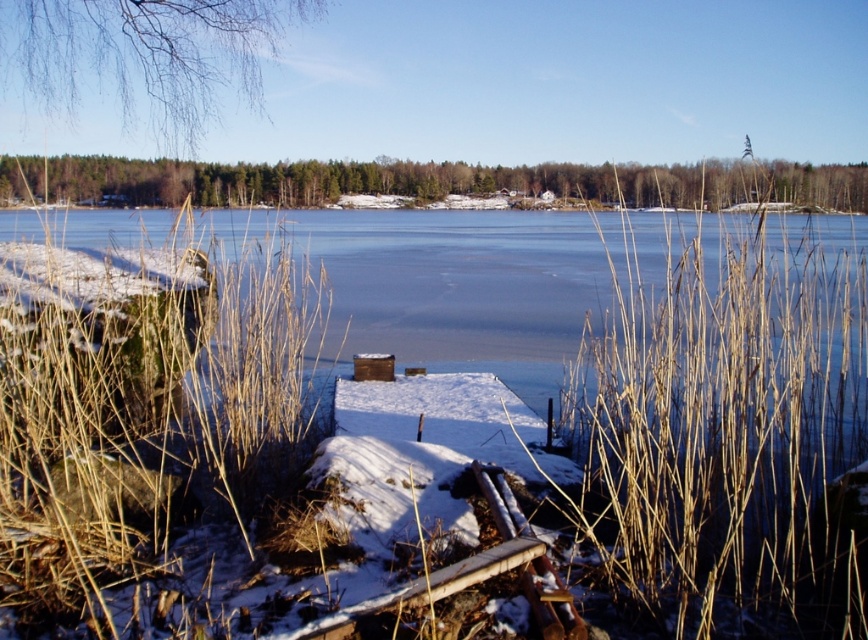
You are an observer standing in the winter landscape. You notice two brown dry reeds in the scene. Which one is closer to you, the brown dry reed at center or the brown dry reed at lower left?

The brown dry reed at center is closer to you because it is in front of the brown dry reed at lower left.

From the picture: You are an environmental scientist assessing the winter landscape. You notice the brown dry reed at lower left and the transparent ice at center. Which object takes up more area in the image?

The transparent ice at center occupies more area than the brown dry reed at lower left.

You are standing at the edge of the frozen lake and want to locate the brown dry reed at center. According to the coordinates provided, in which direction should you look relative to your position?

The brown dry reed at center is located at coordinates point (728, 436). Since the coordinate system is not specified, it is recommended to check the image or map for the exact direction.